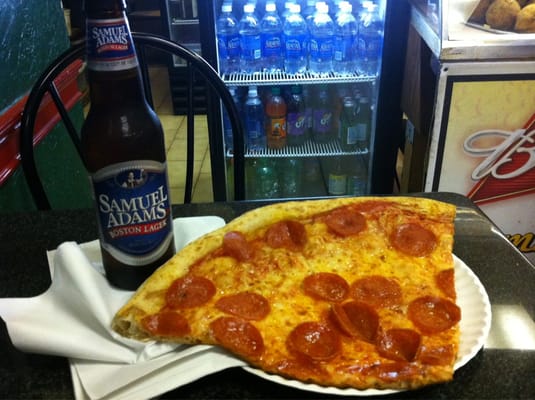
The height and width of the screenshot is (400, 535). In order to click on paper plate in this screenshot , I will do `click(477, 310)`.